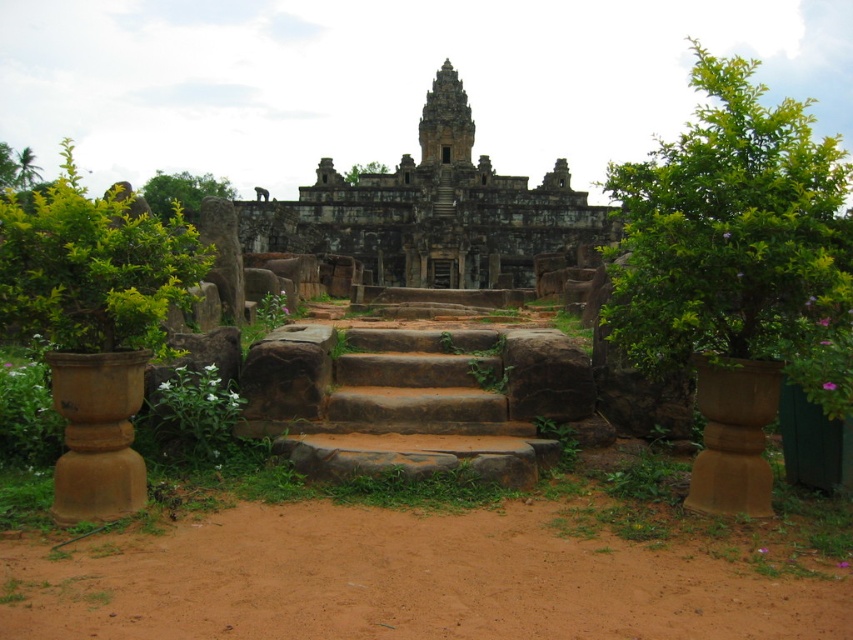
You are standing at the base of the ancient stone structure and notice the brown soil at lower center and the green leafy tree at upper center. Which object is positioned to the right of the other?

The brown soil at lower center is to the right of the green leafy tree at upper center.

You are standing at the base of the ancient stone structure and want to take a photo of the central tower spire. There are two points marked in the scene, point 1 at coordinates (x=389, y=624) and point 2 at (x=225, y=195). Which point should you stand closer to ensure the spire fills your camera frame better?

You should stand closer to point 1 at coordinates (x=389, y=624) because it is closer to the viewer than point 2 at (x=225, y=195), allowing the spire to appear larger in the frame.